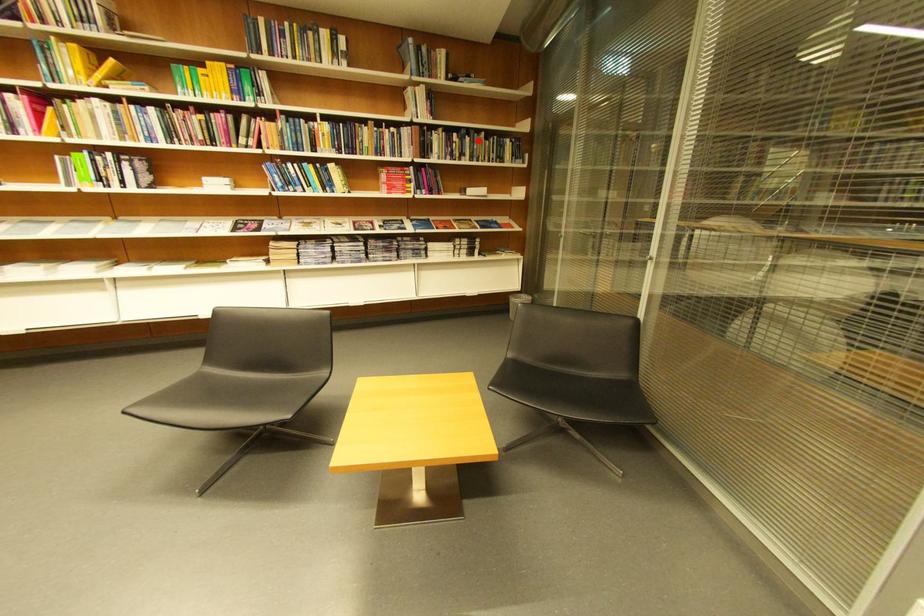
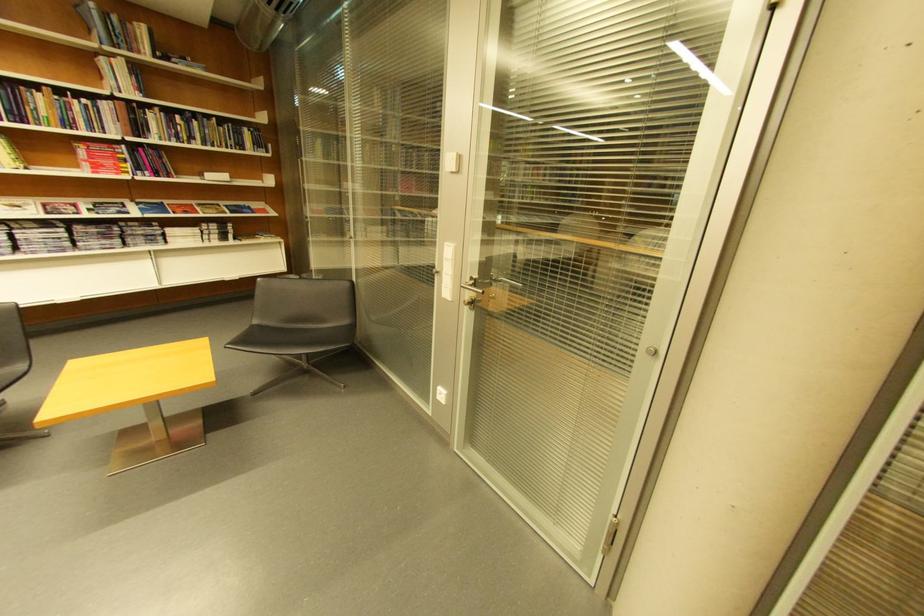
The point at the highlighted location is marked in the first image. Where is the corresponding point in the second image?

(205, 124)